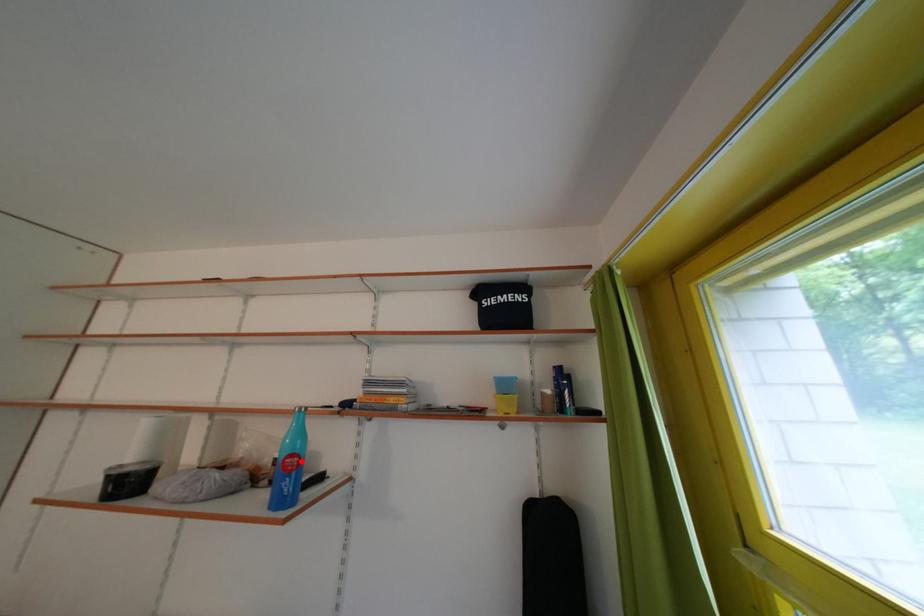
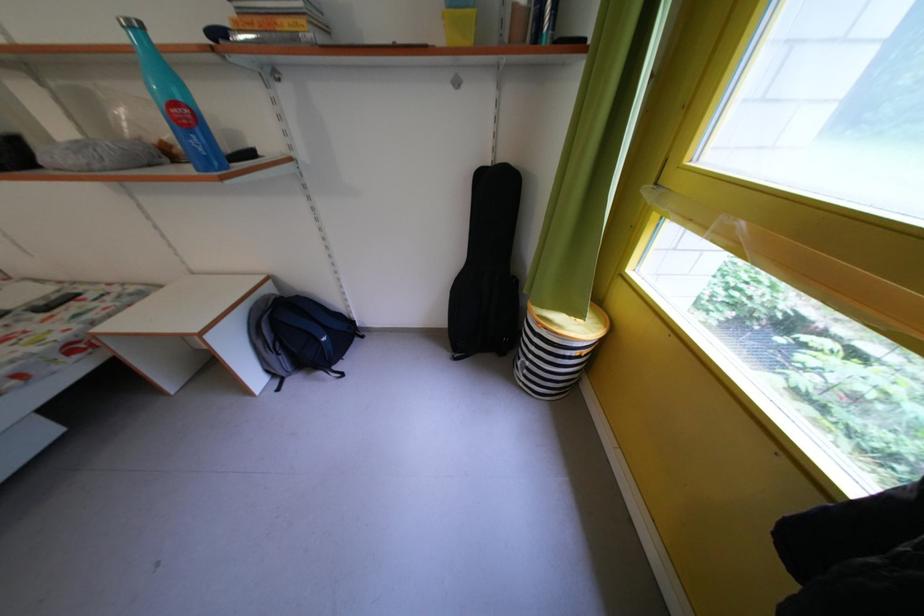
In the second image, find the point that corresponds to the highlighted location in the first image.

(185, 110)